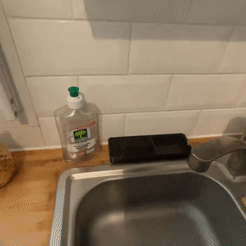
Locate an element on the screen. This screenshot has width=246, height=246. sink is located at coordinates (179, 231).